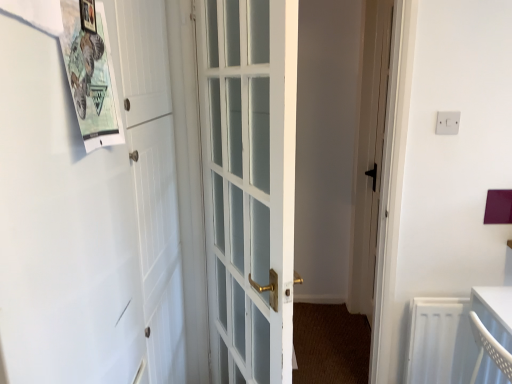
Question: From their relative heights in the image, would you say white plastic electric outlet at upper right is taller or shorter than white glass door at center?

Choices:
 (A) short
 (B) tall

Answer: (A)

Question: Considering the positions of point (445, 125) and point (246, 259), is point (445, 125) closer or farther from the camera than point (246, 259)?

Choices:
 (A) closer
 (B) farther

Answer: (B)

Question: Estimate the real-world distances between objects in this image. Which object is closer to the white glass door at center?

Choices:
 (A) white matte barn door at left
 (B) wooden picture frame at upper left
 (C) white plastic electric outlet at upper right
 (D) paperboard poster at upper left

Answer: (A)

Question: Which is farther from the white matte barn door at left?

Choices:
 (A) white plastic electric outlet at upper right
 (B) white glass door at center
 (C) paperboard poster at upper left
 (D) wooden picture frame at upper left

Answer: (A)